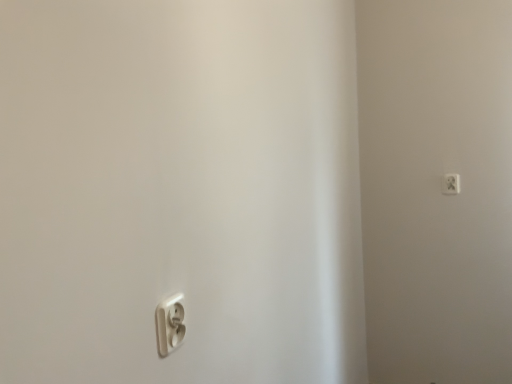
In order to face white plastic power plug at lower left, which is counted as the first power plugs and sockets, starting from the bottom, should I rotate leftwards or rightwards?

Turn left by 10.126 degrees to look at white plastic power plug at lower left, which is counted as the first power plugs and sockets, starting from the bottom.

Describe the element at coordinates (170, 324) in the screenshot. I see `white plastic power plug at lower left, the 1th power plugs and sockets from the front` at that location.

Identify the location of white plastic power plug at lower left, the 2th power plugs and sockets in the top-to-bottom sequence. This screenshot has width=512, height=384. (170, 324).

The width and height of the screenshot is (512, 384). I want to click on white plastic power plug at upper right, which is counted as the 2th power plugs and sockets, starting from the left, so click(x=451, y=184).

What do you see at coordinates (451, 184) in the screenshot?
I see `white plastic power plug at upper right, which is counted as the 2th power plugs and sockets, starting from the left` at bounding box center [451, 184].

What is the approximate width of white plastic power plug at upper right, placed as the second power plugs and sockets when sorted from front to back?

0.50 inches.

You are a GUI agent. You are given a task and a screenshot of the screen. Output one action in this format:
    pyautogui.click(x=<x>, y=<y>)
    Task: Click on the white plastic power plug at lower left, the 1th power plugs and sockets from the front
    This screenshot has width=512, height=384.
    Given the screenshot: What is the action you would take?
    (170, 324)

Does white plastic power plug at upper right, placed as the second power plugs and sockets when sorted from front to back, appear on the right side of white plastic power plug at lower left, marked as the 2th power plugs and sockets in a back-to-front arrangement?

Correct, you'll find white plastic power plug at upper right, placed as the second power plugs and sockets when sorted from front to back, to the right of white plastic power plug at lower left, marked as the 2th power plugs and sockets in a back-to-front arrangement.

Relative to white plastic power plug at lower left, which is counted as the first power plugs and sockets, starting from the bottom, is white plastic power plug at upper right, placed as the second power plugs and sockets when sorted from front to back, in front or behind?

Clearly, white plastic power plug at upper right, placed as the second power plugs and sockets when sorted from front to back, is behind white plastic power plug at lower left, which is counted as the first power plugs and sockets, starting from the bottom.

Is point (459, 184) positioned behind point (177, 301)?

That is True.

From the image's perspective, is white plastic power plug at upper right, acting as the 1th power plugs and sockets starting from the top, under white plastic power plug at lower left, which is the 1th power plugs and sockets from left to right?

No.

From a real-world perspective, which is physically below, white plastic power plug at upper right, acting as the 2th power plugs and sockets starting from the bottom, or white plastic power plug at lower left, the 2th power plugs and sockets in the top-to-bottom sequence?

white plastic power plug at lower left, the 2th power plugs and sockets in the top-to-bottom sequence, is physically lower.

Considering the sizes of objects white plastic power plug at upper right, placed as the second power plugs and sockets when sorted from front to back, and white plastic power plug at lower left, marked as the second power plugs and sockets in a right-to-left arrangement, in the image provided, who is wider, white plastic power plug at upper right, placed as the second power plugs and sockets when sorted from front to back, or white plastic power plug at lower left, marked as the second power plugs and sockets in a right-to-left arrangement,?

With larger width is white plastic power plug at lower left, marked as the second power plugs and sockets in a right-to-left arrangement.

From the picture: Between white plastic power plug at upper right, acting as the 1th power plugs and sockets starting from the top, and white plastic power plug at lower left, the 1th power plugs and sockets from the front, which one has less height?

With less height is white plastic power plug at lower left, the 1th power plugs and sockets from the front.

Can you confirm if white plastic power plug at upper right, the 1th power plugs and sockets when ordered from back to front, is smaller than white plastic power plug at lower left, the 1th power plugs and sockets from the front?

Indeed, white plastic power plug at upper right, the 1th power plugs and sockets when ordered from back to front, has a smaller size compared to white plastic power plug at lower left, the 1th power plugs and sockets from the front.

Is white plastic power plug at upper right, which is counted as the 2th power plugs and sockets, starting from the left, spatially inside white plastic power plug at lower left, the 2th power plugs and sockets in the top-to-bottom sequence, or outside of it?

white plastic power plug at upper right, which is counted as the 2th power plugs and sockets, starting from the left, is located beyond the bounds of white plastic power plug at lower left, the 2th power plugs and sockets in the top-to-bottom sequence.

From the picture: Is the surface of white plastic power plug at upper right, placed as the second power plugs and sockets when sorted from front to back, in direct contact with white plastic power plug at lower left, which is counted as the first power plugs and sockets, starting from the bottom?

There is a gap between white plastic power plug at upper right, placed as the second power plugs and sockets when sorted from front to back, and white plastic power plug at lower left, which is counted as the first power plugs and sockets, starting from the bottom.

Consider the image. Is white plastic power plug at upper right, which is counted as the first power plugs and sockets, starting from the right, positioned with its back to white plastic power plug at lower left, the 2th power plugs and sockets in the top-to-bottom sequence?

white plastic power plug at upper right, which is counted as the first power plugs and sockets, starting from the right, is not turned away from white plastic power plug at lower left, the 2th power plugs and sockets in the top-to-bottom sequence.

Measure the distance between white plastic power plug at upper right, which is counted as the first power plugs and sockets, starting from the right, and white plastic power plug at lower left, marked as the second power plugs and sockets in a right-to-left arrangement.

white plastic power plug at upper right, which is counted as the first power plugs and sockets, starting from the right, and white plastic power plug at lower left, marked as the second power plugs and sockets in a right-to-left arrangement, are 5.71 feet apart.

Identify the location of power plugs and sockets positioned vertically above the white plastic power plug at lower left, which is counted as the first power plugs and sockets, starting from the bottom (from a real-world perspective). This screenshot has height=384, width=512. (451, 184).

Can you confirm if white plastic power plug at lower left, the 1th power plugs and sockets from the front, is positioned to the right of white plastic power plug at upper right, acting as the 1th power plugs and sockets starting from the top?

No.

Looking at this image, considering the positions of objects white plastic power plug at lower left, which is the 1th power plugs and sockets from left to right, and white plastic power plug at upper right, which is counted as the first power plugs and sockets, starting from the right, in the image provided, who is behind, white plastic power plug at lower left, which is the 1th power plugs and sockets from left to right, or white plastic power plug at upper right, which is counted as the first power plugs and sockets, starting from the right,?

white plastic power plug at upper right, which is counted as the first power plugs and sockets, starting from the right.

Which is more distant, (164, 308) or (445, 186)?

The point (445, 186) is farther.

Looking at this image, from the image's perspective, which is above, white plastic power plug at lower left, which is the 1th power plugs and sockets from left to right, or white plastic power plug at upper right, which is counted as the first power plugs and sockets, starting from the right?

white plastic power plug at upper right, which is counted as the first power plugs and sockets, starting from the right.

Looking at this image, from a real-world perspective, between white plastic power plug at lower left, the 2th power plugs and sockets in the top-to-bottom sequence, and white plastic power plug at upper right, the 1th power plugs and sockets when ordered from back to front, who is vertically higher?

white plastic power plug at upper right, the 1th power plugs and sockets when ordered from back to front, from a real-world perspective.

Between white plastic power plug at lower left, the 1th power plugs and sockets from the front, and white plastic power plug at upper right, acting as the 2th power plugs and sockets starting from the bottom, which one has smaller width?

white plastic power plug at upper right, acting as the 2th power plugs and sockets starting from the bottom.

Can you confirm if white plastic power plug at lower left, which is the 1th power plugs and sockets from left to right, is shorter than white plastic power plug at upper right, which is counted as the 2th power plugs and sockets, starting from the left?

Yes, white plastic power plug at lower left, which is the 1th power plugs and sockets from left to right, is shorter than white plastic power plug at upper right, which is counted as the 2th power plugs and sockets, starting from the left.

Is white plastic power plug at lower left, which is counted as the first power plugs and sockets, starting from the bottom, bigger or smaller than white plastic power plug at upper right, acting as the 1th power plugs and sockets starting from the top?

In the image, white plastic power plug at lower left, which is counted as the first power plugs and sockets, starting from the bottom, appears to be larger than white plastic power plug at upper right, acting as the 1th power plugs and sockets starting from the top.

Would you say white plastic power plug at lower left, which is counted as the first power plugs and sockets, starting from the bottom, contains white plastic power plug at upper right, acting as the 1th power plugs and sockets starting from the top?

No, white plastic power plug at upper right, acting as the 1th power plugs and sockets starting from the top, is not a part of white plastic power plug at lower left, which is counted as the first power plugs and sockets, starting from the bottom.

Is white plastic power plug at lower left, the 2th power plugs and sockets in the top-to-bottom sequence, not near white plastic power plug at upper right, placed as the second power plugs and sockets when sorted from front to back?

Yes, white plastic power plug at lower left, the 2th power plugs and sockets in the top-to-bottom sequence, is far from white plastic power plug at upper right, placed as the second power plugs and sockets when sorted from front to back.

Could you tell me if white plastic power plug at lower left, which is counted as the first power plugs and sockets, starting from the bottom, is turned towards white plastic power plug at upper right, acting as the 1th power plugs and sockets starting from the top?

No, white plastic power plug at lower left, which is counted as the first power plugs and sockets, starting from the bottom, is not turned towards white plastic power plug at upper right, acting as the 1th power plugs and sockets starting from the top.

How many degrees apart are the facing directions of white plastic power plug at lower left, the 2th power plugs and sockets in the top-to-bottom sequence, and white plastic power plug at upper right, which is counted as the 2th power plugs and sockets, starting from the left?

The angular difference between white plastic power plug at lower left, the 2th power plugs and sockets in the top-to-bottom sequence, and white plastic power plug at upper right, which is counted as the 2th power plugs and sockets, starting from the left, is 89.7 degrees.

Measure the distance from white plastic power plug at lower left, the 1th power plugs and sockets from the front, to white plastic power plug at upper right, the 1th power plugs and sockets when ordered from back to front.

The distance of white plastic power plug at lower left, the 1th power plugs and sockets from the front, from white plastic power plug at upper right, the 1th power plugs and sockets when ordered from back to front, is 5.71 feet.

Find the location of `power plugs and sockets located above the white plastic power plug at lower left, marked as the 2th power plugs and sockets in a back-to-front arrangement (from a real-world perspective)`. power plugs and sockets located above the white plastic power plug at lower left, marked as the 2th power plugs and sockets in a back-to-front arrangement (from a real-world perspective) is located at coordinates (451, 184).

At what (x,y) coordinates should I click in order to perform the action: click on power plugs and sockets that appears on the left of white plastic power plug at upper right, placed as the second power plugs and sockets when sorted from front to back. Please return your answer as a coordinate pair (x, y). Looking at the image, I should click on (170, 324).

I want to click on power plugs and sockets that appears below the white plastic power plug at upper right, acting as the 1th power plugs and sockets starting from the top (from a real-world perspective), so click(170, 324).